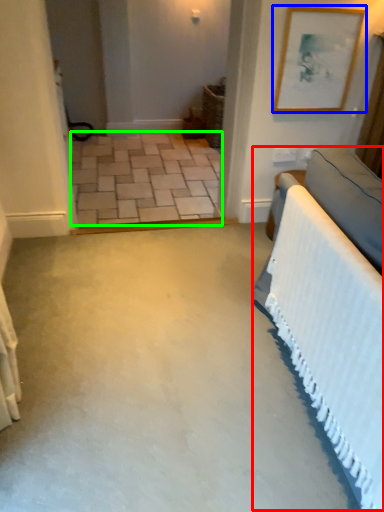
Question: Considering the real-world distances, which object is closest to bed (highlighted by a red box)? picture frame (highlighted by a blue box) or concrete (highlighted by a green box).

Choices:
 (A) picture frame
 (B) concrete

Answer: (A)